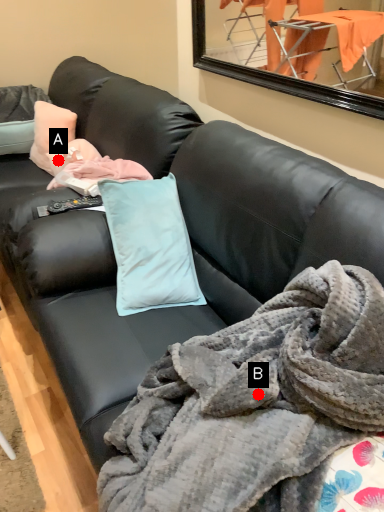
Question: Two points are circled on the image, labeled by A and B beside each circle. Which point is closer to the camera taking this photo?

Choices:
 (A) A is closer
 (B) B is closer

Answer: (B)